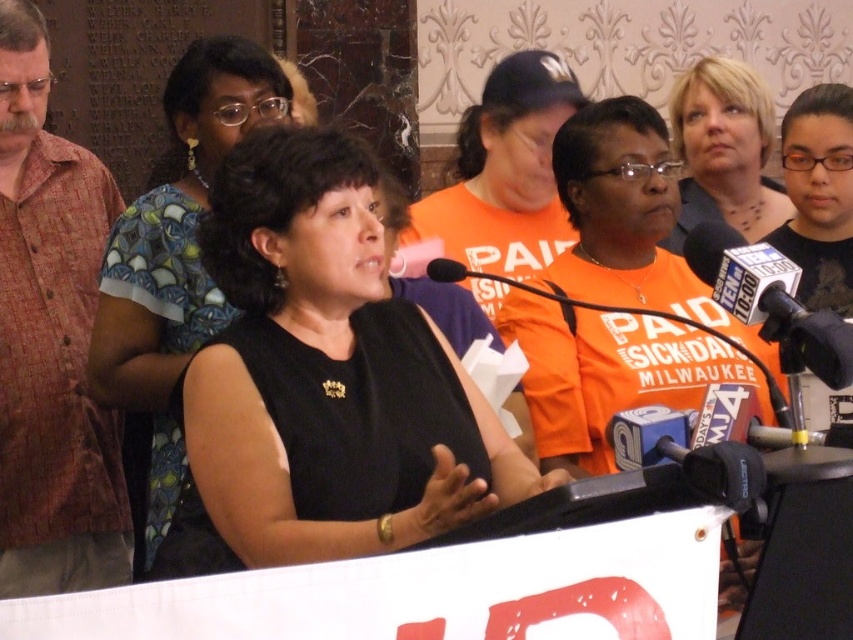
You are a photographer at the event and want to capture a clear shot of the metallic silver microphone at center right without the blonde hair at upper right blocking it. What adjustment should you make to your camera angle?

Since the blonde hair at upper right is larger in size than the metallic silver microphone at center right, you should lower your camera angle to avoid the blonde hair at upper right obstructing the view of the microphone.

You are a sound technician in a large hall. You need to adjust the volume for the microphone. The metallic silver microphone at center right is currently at maximum volume. If the blonde hair at upper right is 16.60 meters away from the microphone, is the sound likely to be too loud for them?

The distance between the blonde hair at upper right and the metallic silver microphone at center right is 16.60 meters. At this distance, the sound from the microphone would likely be too loud for the person with blonde hair at upper right, so reducing the volume might be necessary.

You are a photographer at the event and want to capture a closeup of the black fabric at center without the metallic silver microphone at center right appearing in the frame. Is this possible based on their positions?

The black fabric at center is below the metallic silver microphone at center right, so you can position the camera to focus on the black fabric at center while avoiding the metallic silver microphone at center right by angling the shot downward.